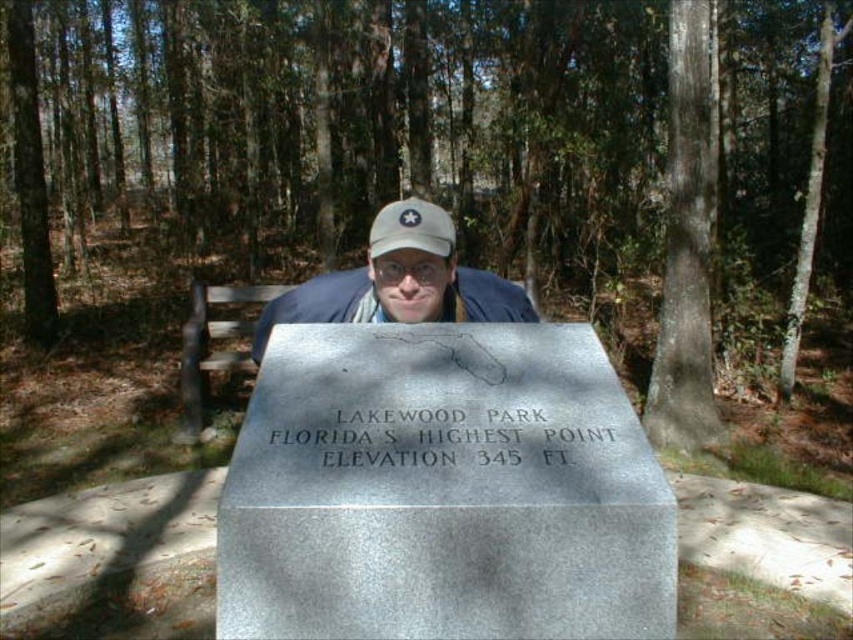
The width and height of the screenshot is (853, 640). Describe the element at coordinates (399, 280) in the screenshot. I see `white matte cap at center` at that location.

Describe the element at coordinates (399, 280) in the screenshot. I see `white matte cap at center` at that location.

Identify the location of white matte cap at center. This screenshot has width=853, height=640. (399, 280).

Can you confirm if white matte cap at center is smaller than brown wooden bench at left?

Yes, white matte cap at center is smaller than brown wooden bench at left.

Who is more distant from viewer, (454,291) or (239,364)?

Positioned behind is point (239,364).

From the picture: Who is more forward, (482, 296) or (225, 324)?

Positioned in front is point (482, 296).

This screenshot has height=640, width=853. Identify the location of white matte cap at center. 399,280.

Is point (206, 412) more distant than point (387, 230)?

Yes, it is behind point (387, 230).

Which is behind, point (193, 403) or point (399, 243)?

The point (193, 403) is more distant.

Is point (221, 364) more distant than point (373, 250)?

That is True.

Where is `brown wooden bench at left`? The image size is (853, 640). brown wooden bench at left is located at coordinates (207, 346).